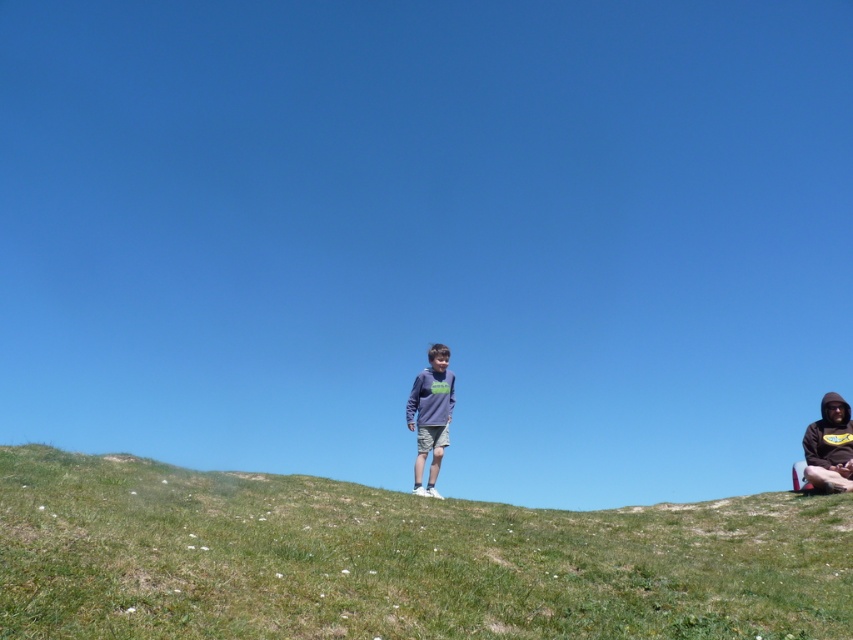
Does green grassy hillside at center appear over gray hoodie at center?

Incorrect, green grassy hillside at center is not positioned above gray hoodie at center.

Image resolution: width=853 pixels, height=640 pixels. Identify the location of green grassy hillside at center. (397, 560).

Looking at this image, measure the distance from green grassy hillside at center to dark brown hoodie at lower right.

A distance of 18.77 feet exists between green grassy hillside at center and dark brown hoodie at lower right.

Measure the distance between green grassy hillside at center and camera.

The distance of green grassy hillside at center from camera is 3.10 meters.

The height and width of the screenshot is (640, 853). I want to click on green grassy hillside at center, so click(x=397, y=560).

Consider the image. Which is above, gray hoodie at center or dark brown hoodie at lower right?

gray hoodie at center is higher up.

Does gray hoodie at center have a larger size compared to dark brown hoodie at lower right?

Incorrect, gray hoodie at center is not larger than dark brown hoodie at lower right.

Which is behind, point (419, 422) or point (814, 483)?

Positioned behind is point (419, 422).

Locate an element on the screen. This screenshot has height=640, width=853. gray hoodie at center is located at coordinates (430, 416).